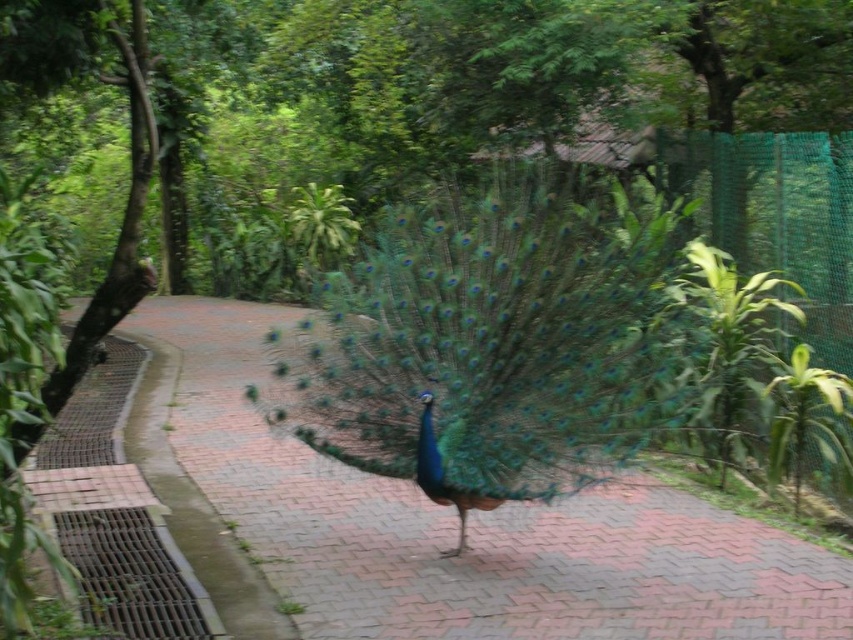
You are a photographer aiming to capture the shiny blue peacock at center and the brick pavement at center in a single frame. Based on their positions, which object should you adjust your camera to focus on first if you want to include both in your shot?

The shiny blue peacock at center is to the right of the brick pavement at center, so you should focus on the brick pavement at center first to ensure both are in the frame.

You are a zookeeper who needs to feed the shiny blue peacock at center. You have a food container that you can open from 10 feet away. Can you feed the peacock without approaching closer than 10 feet?

The shiny blue peacock at center and the viewer are 14.66 feet apart, which is farther than 10 feet. Therefore, you can feed the peacock without approaching closer than 10 feet.

You are a zookeeper standing at the entrance of the peacock enclosure. You need to locate the exact spot where a visitor reported seeing a peacock. The coordinates provided by the visitor are point (494,342). Based on the image, where is this point located?

The point (494,342) is on the shiny blue peacock at center, so the visitor was looking at the peacock in the middle of the scene.